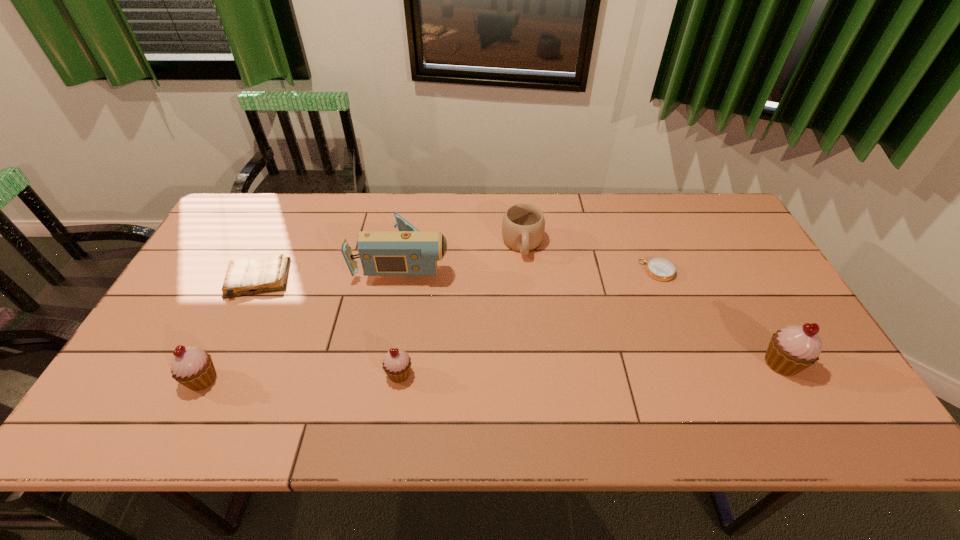
Find the location of a particular element. diary positioned at the left edge is located at coordinates (245, 276).

Identify the location of object present at the right edge. (792, 349).

Locate an element on the screen. The width and height of the screenshot is (960, 540). object that is at the near left corner is located at coordinates (192, 367).

Find the location of a particular element. object that is at the near right corner is located at coordinates (792, 349).

Where is `free space at the far edge of the desktop`? free space at the far edge of the desktop is located at coordinates (544, 194).

In the image, there is a desktop. Where is `vacant space at the near edge`? This screenshot has height=540, width=960. vacant space at the near edge is located at coordinates (674, 389).

The height and width of the screenshot is (540, 960). In the image, there is a desktop. Find the location of `blank space at the left edge`. blank space at the left edge is located at coordinates (213, 274).

The height and width of the screenshot is (540, 960). Find the location of `vacant area at the right edge of the desktop`. vacant area at the right edge of the desktop is located at coordinates (719, 269).

Locate an element on the screen. Image resolution: width=960 pixels, height=540 pixels. empty location between the second shortest cupcake and the rightmost cupcake is located at coordinates (492, 372).

This screenshot has height=540, width=960. I want to click on free space between the camcorder and the diary, so click(x=331, y=268).